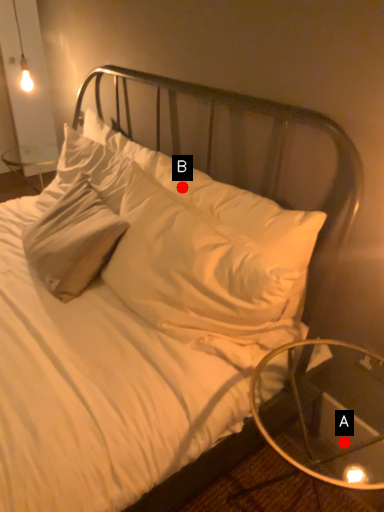
Question: Two points are circled on the image, labeled by A and B beside each circle. Which point is closer to the camera?

Choices:
 (A) A is closer
 (B) B is closer

Answer: (B)